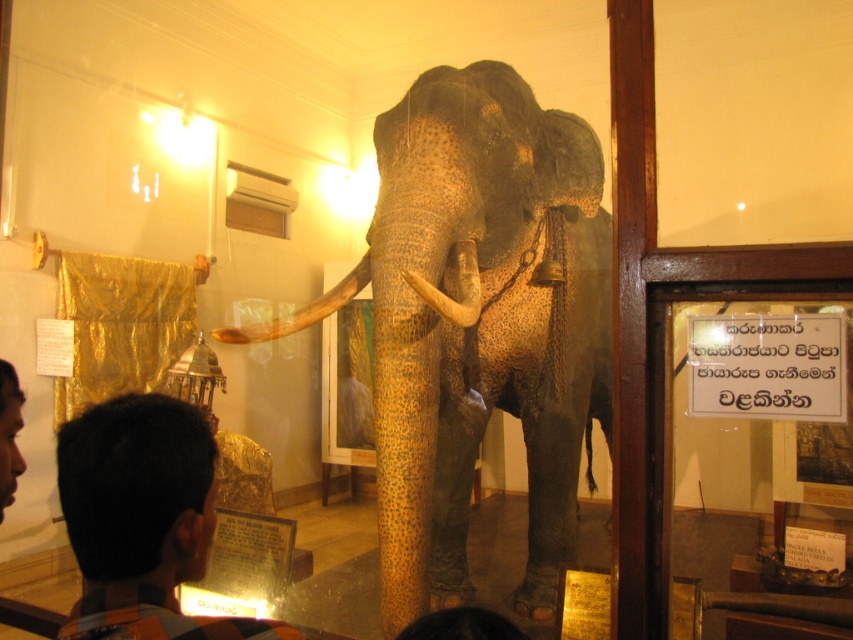
In the scene shown: You are a museum visitor standing in front of the exhibit. You want to take a photo of the white ivory tusk at center without the spotted brown elephant at center blocking the view. Is this possible given their positions?

The spotted brown elephant at center is further to the viewer than the white ivory tusk at center, so the elephant is closer to you and would block the view of the tusk. Therefore, it is not possible to take a photo of the white ivory tusk at center without the elephant blocking it.

You are a museum guide who needs to ensure visitors can safely walk between the spotted brown elephant at center and the brown hair at lower left without tripping. What is the minimum width of the path required between these two objects?

The minimum width of the path required between the spotted brown elephant at center and the brown hair at lower left is 5.35 feet, so visitors can safely walk without tripping.

You are a museum security guard who needs to measure the distance between the two tusks for a safety inspection. Given that your measuring tape can only extend up to 16 inches, will it be sufficient to measure the space between the shiny gold tusk at center and the white ivory tusk at center?

The distance between the shiny gold tusk at center and the white ivory tusk at center is 16.83 inches, which exceeds the 16 inches capacity of the measuring tape. Therefore, the tape is not sufficient for this measurement.